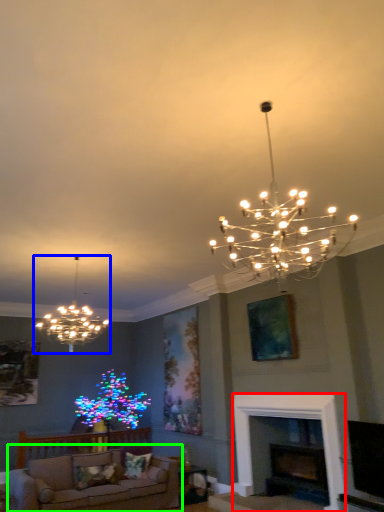
Question: Based on their relative distances, which object is nearer to fireplace (highlighted by a red box)? Choose from lamp (highlighted by a blue box) and studio couch (highlighted by a green box).

Choices:
 (A) lamp
 (B) studio couch

Answer: (B)